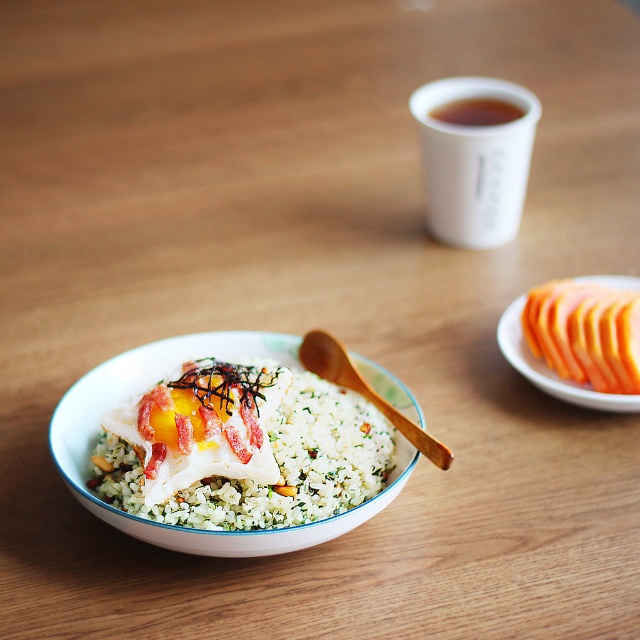
Question: Is smooth orange slices at right thinner than brown paper cup at upper center?

Choices:
 (A) yes
 (B) no

Answer: (B)

Question: Which of these objects is positioned closest to the white textured rice at center?

Choices:
 (A) wooden spoon at center
 (B) brown paper cup at upper center
 (C) white matte cup at upper center

Answer: (A)

Question: Which object is farther from the camera taking this photo?

Choices:
 (A) smooth orange slices at right
 (B) white matte cup at upper center

Answer: (B)

Question: Estimate the real-world distances between objects in this image. Which object is farther from the brown paper cup at upper center?

Choices:
 (A) smooth orange slices at right
 (B) white matte cup at upper center
 (C) wooden spoon at center

Answer: (C)

Question: Is white matte cup at upper center closer to the viewer compared to wooden spoon at center?

Choices:
 (A) no
 (B) yes

Answer: (A)

Question: Observing the image, what is the correct spatial positioning of white matte cup at upper center in reference to smooth orange slices at right?

Choices:
 (A) right
 (B) left

Answer: (B)